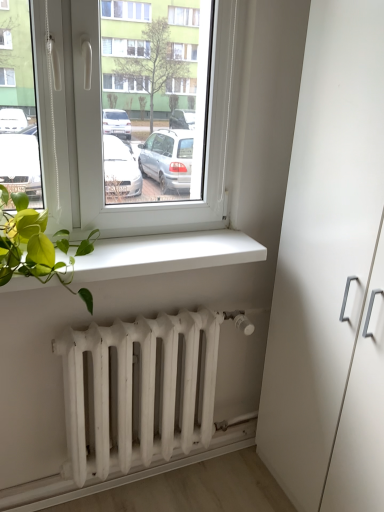
The height and width of the screenshot is (512, 384). Identify the location of free region under white matte radiator at lower center (from a real-world perspective). (97, 490).